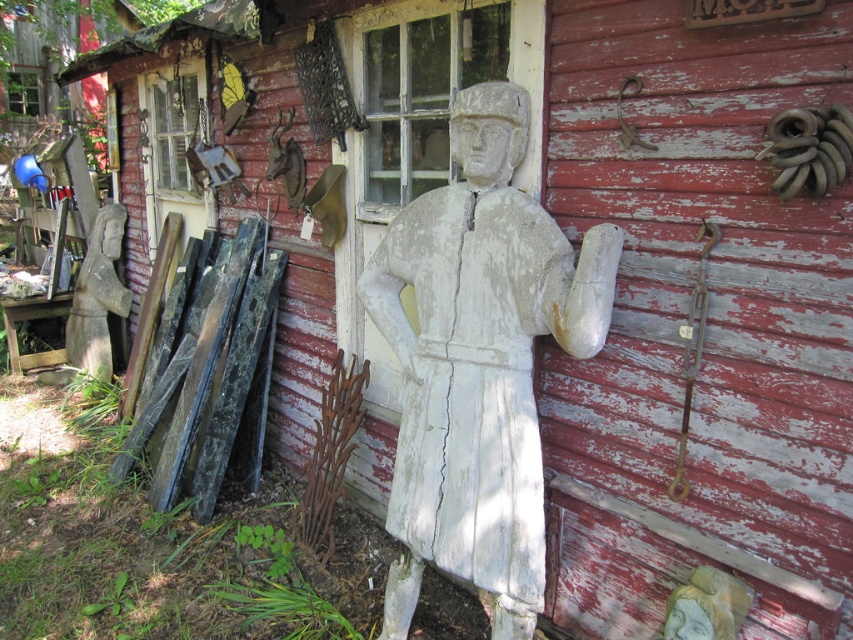
Which is behind, point (509, 104) or point (97, 348)?

The point (97, 348) is more distant.

What do you see at coordinates (479, 362) in the screenshot?
I see `white weathered wood statue at center` at bounding box center [479, 362].

Where is `white weathered wood statue at center`? white weathered wood statue at center is located at coordinates (479, 362).